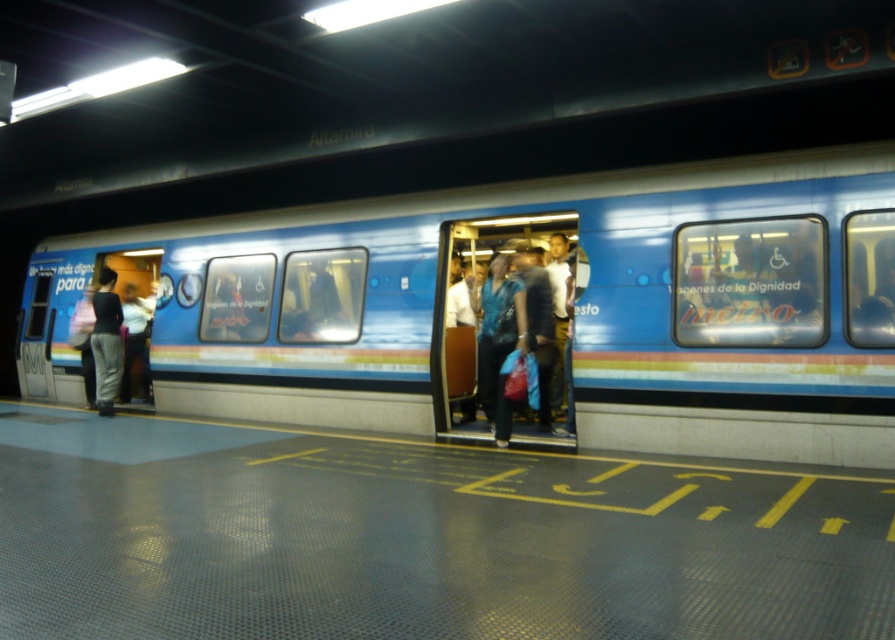
Question: From the image, what is the correct spatial relationship of blue glossy train at center in relation to black matte pants at left?

Choices:
 (A) below
 (B) above

Answer: (B)

Question: Which point appears farthest from the camera in this image?

Choices:
 (A) (466, 360)
 (B) (101, 403)

Answer: (B)

Question: Which object appears farthest from the camera in this image?

Choices:
 (A) blue glossy train at center
 (B) blue fabric bag at center

Answer: (B)

Question: Which point is farther from the camera taking this photo?

Choices:
 (A) (209, 308)
 (B) (104, 301)
 (C) (507, 444)

Answer: (A)

Question: Does blue glossy train at center appear over black matte pants at left?

Choices:
 (A) yes
 (B) no

Answer: (A)

Question: Is blue fabric bag at center below black matte pants at left?

Choices:
 (A) no
 (B) yes

Answer: (A)